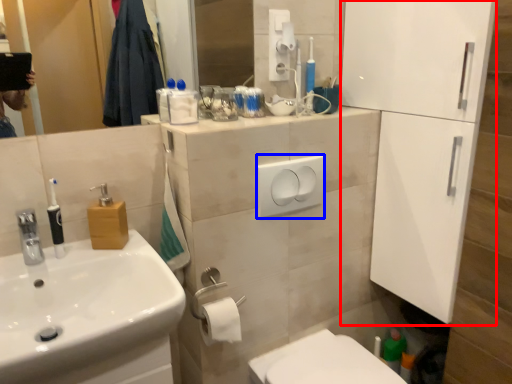
Question: Which object is further to the camera taking this photo, screen door (highlighted by a red box) or light switch (highlighted by a blue box)?

Choices:
 (A) screen door
 (B) light switch

Answer: (B)